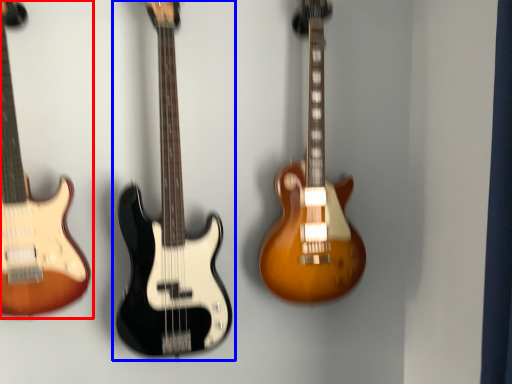
Question: Which of the following is the farthest to the observer, guitar (highlighted by a red box) or guitar (highlighted by a blue box)?

Choices:
 (A) guitar
 (B) guitar

Answer: (B)